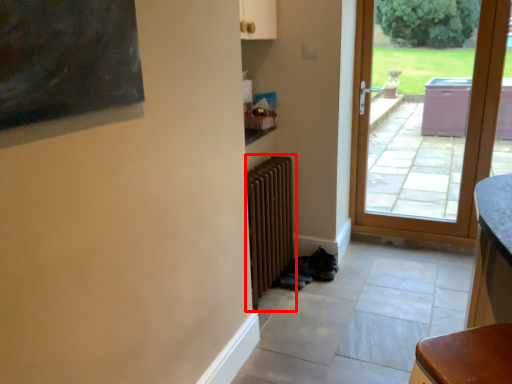
Question: From the image's perspective, where is radiator (annotated by the red box) located relative to door?

Choices:
 (A) below
 (B) above

Answer: (A)